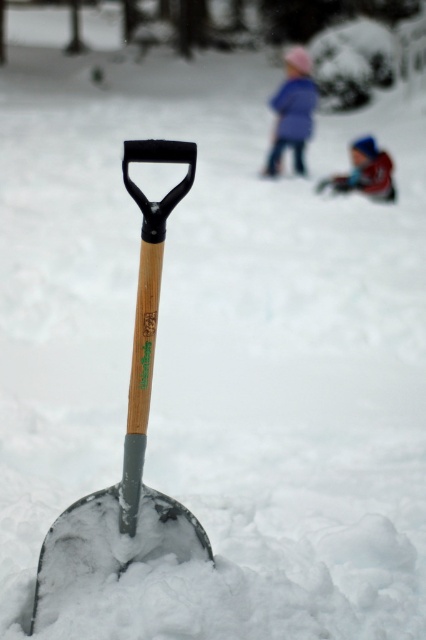
From the picture: Is metallic silver shovel at center wider than blue woolen sweater at upper center?

In fact, metallic silver shovel at center might be narrower than blue woolen sweater at upper center.

What do you see at coordinates (138, 326) in the screenshot? The width and height of the screenshot is (426, 640). I see `metallic silver shovel at center` at bounding box center [138, 326].

You are a GUI agent. You are given a task and a screenshot of the screen. Output one action in this format:
    pyautogui.click(x=<x>, y=<y>)
    Task: Click on the metallic silver shovel at center
    
    Given the screenshot: What is the action you would take?
    pyautogui.click(x=138, y=326)

Who is positioned more to the left, metallic silver shovel at center or blue knit hat at upper center?

metallic silver shovel at center is more to the left.

Is metallic silver shovel at center taller than blue knit hat at upper center?

Yes.

This screenshot has width=426, height=640. I want to click on metallic silver shovel at center, so click(x=138, y=326).

This screenshot has width=426, height=640. Find the location of `metallic silver shovel at center`. metallic silver shovel at center is located at coordinates (138, 326).

Does blue woolen sweater at upper center have a greater height compared to blue knit hat at upper center?

Yes, blue woolen sweater at upper center is taller than blue knit hat at upper center.

Can you confirm if blue woolen sweater at upper center is wider than blue knit hat at upper center?

No.

Who is more distant from viewer, (287, 60) or (334, 188)?

Point (287, 60)

This screenshot has height=640, width=426. Find the location of `blue woolen sweater at upper center`. blue woolen sweater at upper center is located at coordinates (293, 112).